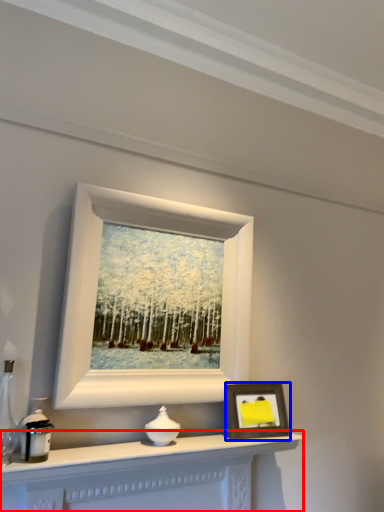
Question: Which object is closer to the camera taking this photo, table (highlighted by a red box) or picture frame (highlighted by a blue box)?

Choices:
 (A) table
 (B) picture frame

Answer: (A)